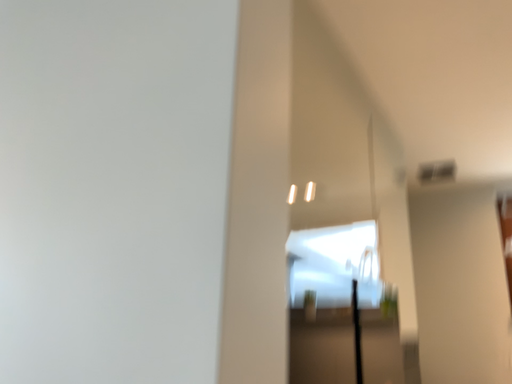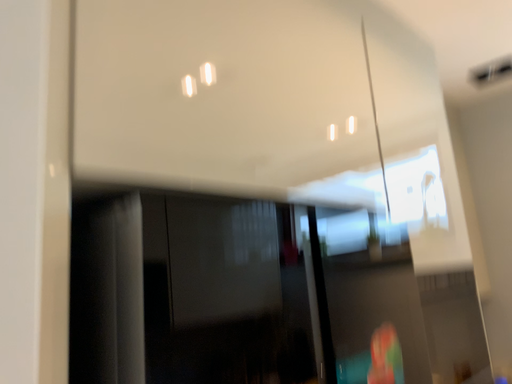
Question: How did the camera likely rotate when shooting the video?

Choices:
 (A) rotated downward
 (B) rotated upward

Answer: (A)